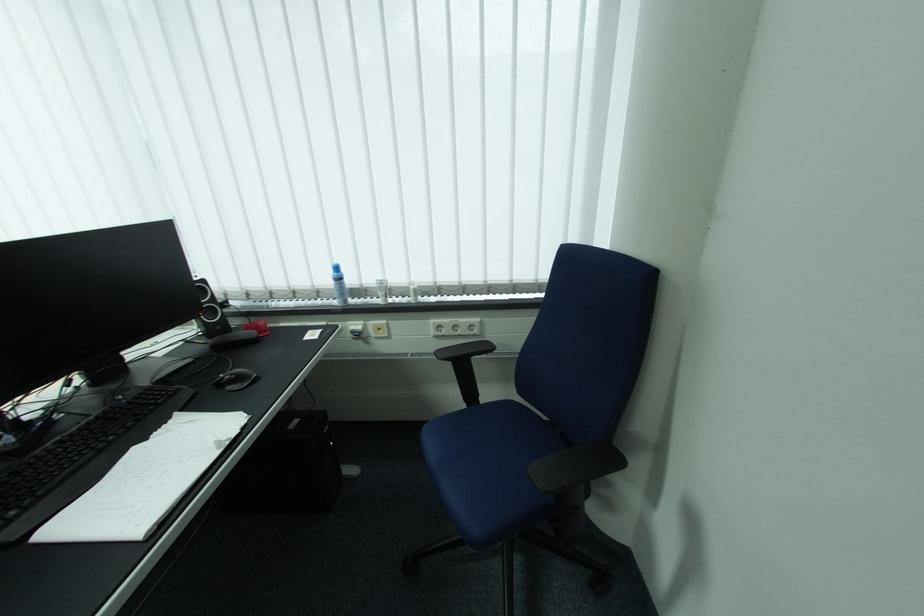
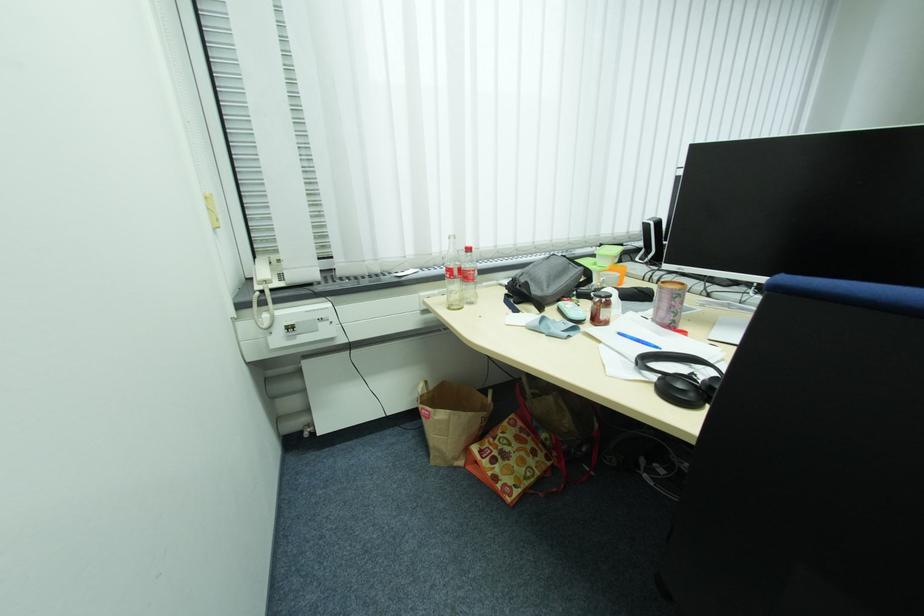
Question: I am providing you with two images of the same scene from different viewpoints. Which of the following objects are not visible in image2?

Choices:
 (A) white cosmetic tube
 (B) patterned tote bag
 (C) cans bin slot
 (D) light blue case

Answer: (A)